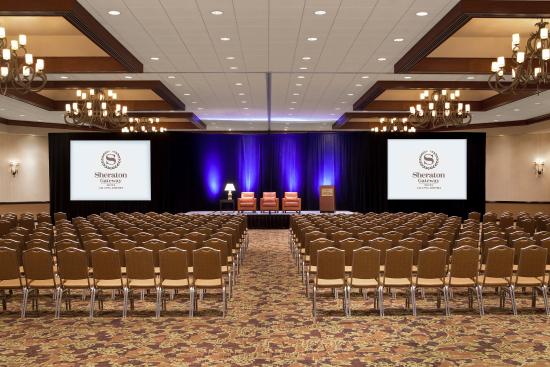
This screenshot has height=367, width=550. What are the coordinates of `ceiling` in the screenshot? It's located at pyautogui.click(x=103, y=107).